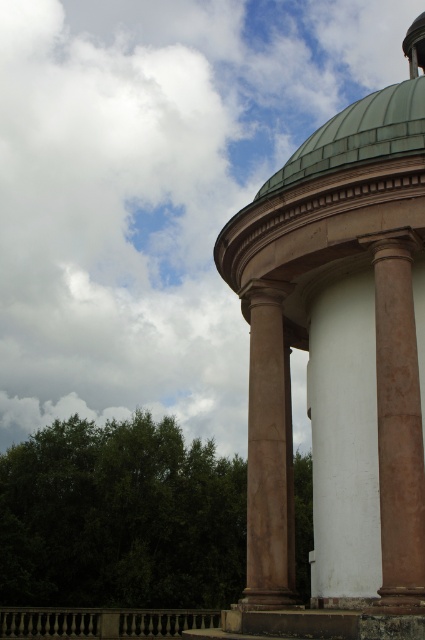
Which is above, white fluffy cloud at upper left or green copper dome at upper right?

green copper dome at upper right

Who is more forward, (99, 259) or (240, 244)?

Point (240, 244) is more forward.

This screenshot has width=425, height=640. What are the coordinates of `white fluffy cloud at upper left` in the screenshot? It's located at (153, 188).

Can you confirm if matte brown gazebo at center is thinner than green copper dome at upper right?

Correct, matte brown gazebo at center's width is less than green copper dome at upper right's.

Who is more distant from viewer, (x=379, y=90) or (x=382, y=104)?

The point (x=379, y=90) is more distant.

The image size is (425, 640). In order to click on matte brown gazebo at center in this screenshot , I will do `click(340, 353)`.

Between point (329, 154) and point (379, 385), which one is positioned in front?

Point (379, 385) is more forward.

Between green copper dome at upper right and brown polished column at right, which one has more height?

green copper dome at upper right

The image size is (425, 640). What do you see at coordinates (326, 172) in the screenshot?
I see `green copper dome at upper right` at bounding box center [326, 172].

Image resolution: width=425 pixels, height=640 pixels. Find the location of `green copper dome at upper right`. green copper dome at upper right is located at coordinates (326, 172).